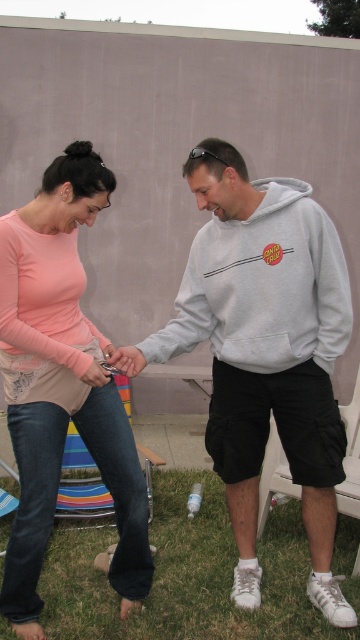
Question: Is gray cotton sweatshirt at center positioned in front of white plastic chair at lower right?

Choices:
 (A) no
 (B) yes

Answer: (B)

Question: Does gray cotton sweatshirt at center appear on the right side of striped fabric chair at lower left?

Choices:
 (A) yes
 (B) no

Answer: (A)

Question: From the image, what is the correct spatial relationship of gray cotton sweatshirt at center in relation to striped fabric chair at lower left?

Choices:
 (A) right
 (B) left

Answer: (A)

Question: Which point is farther to the camera?

Choices:
 (A) white plastic chair at lower right
 (B) gray cotton sweatshirt at center
 (C) pink matte shirt at upper left

Answer: (A)

Question: Among these objects, which one is nearest to the camera?

Choices:
 (A) pink matte shirt at upper left
 (B) white plastic chair at lower right

Answer: (A)

Question: Which object is the farthest from the white plastic chair at lower right?

Choices:
 (A) gray cotton sweatshirt at center
 (B) pink matte shirt at upper left
 (C) striped fabric chair at lower left

Answer: (C)